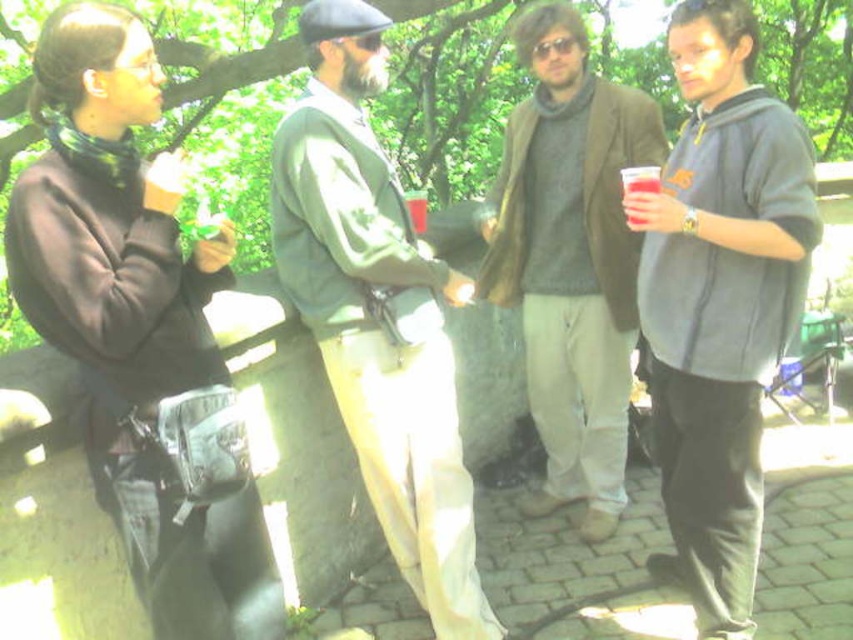
Is the position of matte plastic cup at upper left less distant than that of translucent plastic cup at center?

Yes, it is.

Which is behind, point (173, 202) or point (421, 216)?

The point (421, 216) is more distant.

You are a GUI agent. You are given a task and a screenshot of the screen. Output one action in this format:
    pyautogui.click(x=<x>, y=<y>)
    Task: Click on the matte plastic cup at upper left
    This screenshot has height=640, width=853.
    Given the screenshot: What is the action you would take?
    161,195

Between point (613, 525) and point (409, 211), which one is positioned behind?

Positioned behind is point (613, 525).

Can you confirm if knit sweater at center is positioned above translucent plastic cup at center?

No, knit sweater at center is not above translucent plastic cup at center.

Is point (564, 298) closer to viewer compared to point (416, 208)?

No.

Locate an element on the screen. Image resolution: width=853 pixels, height=640 pixels. knit sweater at center is located at coordinates (572, 259).

Can you confirm if green fabric jacket at center is taller than matte plastic cup at upper left?

Indeed, green fabric jacket at center has a greater height compared to matte plastic cup at upper left.

Which is behind, point (401, 406) or point (178, 184)?

Positioned behind is point (401, 406).

Measure the distance between point (422,506) and camera.

Point (422,506) and camera are 7.67 feet apart.

This screenshot has width=853, height=640. In order to click on green fabric jacket at center in this screenshot , I will do `click(376, 314)`.